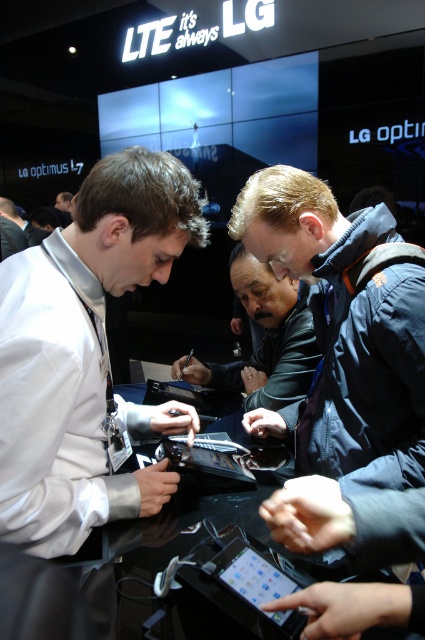
Question: Can you confirm if white glossy shirt at left is positioned to the right of blue fabric jacket at center?

Choices:
 (A) no
 (B) yes

Answer: (A)

Question: Does white glossy shirt at left lie in front of metallic silver tablet at center?

Choices:
 (A) no
 (B) yes

Answer: (B)

Question: Among these objects, which one is farthest from the camera?

Choices:
 (A) white glossy shirt at left
 (B) black leather jacket at center
 (C) blue fabric jacket at center

Answer: (B)

Question: Based on their relative distances, which object is nearer to the white glossy shirt at left?

Choices:
 (A) blue fabric jacket at center
 (B) black leather jacket at center
 (C) metallic silver tablet at center

Answer: (C)

Question: Which point is closer to the camera?

Choices:
 (A) (263, 300)
 (B) (8, 308)
 (C) (221, 465)
 (D) (297, 257)

Answer: (B)

Question: Is blue fabric jacket at center below metallic silver tablet at center?

Choices:
 (A) no
 (B) yes

Answer: (A)